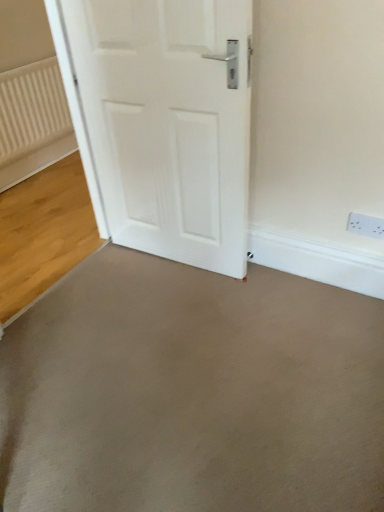
What are the coordinates of `free region on the left part of white matte door at center` in the screenshot? It's located at (105, 285).